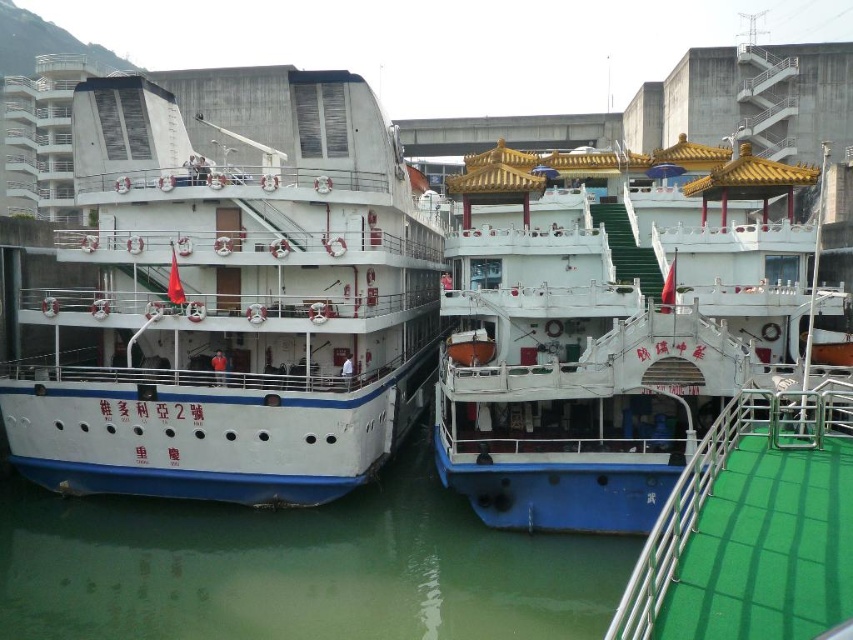
Question: Observing the image, what is the correct spatial positioning of white matte cruise ship at left in reference to white glossy boat at center?

Choices:
 (A) below
 (B) above

Answer: (B)

Question: Is white matte cruise ship at left closer to camera compared to white glossy boat at center?

Choices:
 (A) no
 (B) yes

Answer: (A)

Question: Which of the following is the closest to the observer?

Choices:
 (A) white glossy boat at center
 (B) white matte cruise ship at left

Answer: (A)

Question: Which object appears farthest from the camera in this image?

Choices:
 (A) white glossy boat at center
 (B) white matte cruise ship at left

Answer: (B)

Question: Can you confirm if white matte cruise ship at left is positioned to the left of white glossy boat at center?

Choices:
 (A) no
 (B) yes

Answer: (B)

Question: Which of the following is the closest to the observer?

Choices:
 (A) (630, 193)
 (B) (166, 449)

Answer: (B)